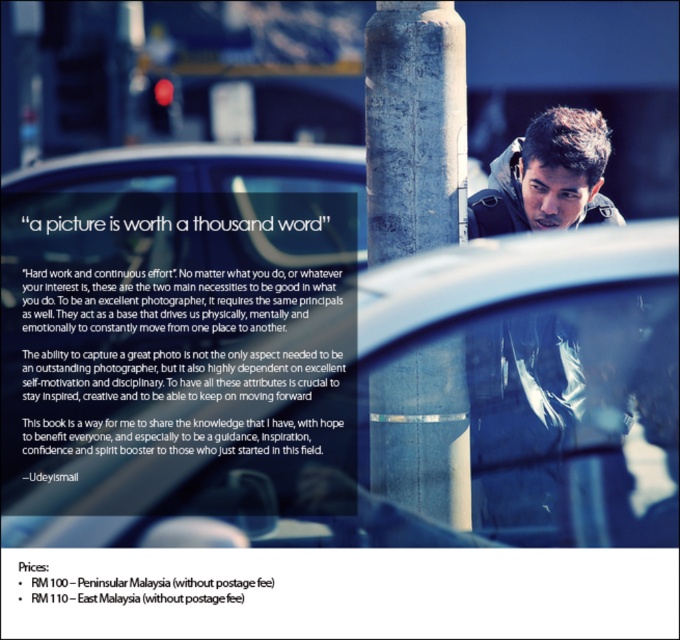
Is point (396, 532) more distant than point (530, 202)?

No, it is in front of (530, 202).

Who is positioned more to the right, clear glass car at center or matte black jacket at upper right?

matte black jacket at upper right

Locate an element on the screen. clear glass car at center is located at coordinates (401, 416).

Does clear glass car at center have a lesser height compared to dark gray jacket at center?

No, clear glass car at center is not shorter than dark gray jacket at center.

Is clear glass car at center in front of dark gray jacket at center?

Yes, clear glass car at center is in front of dark gray jacket at center.

Does point (549, 536) come in front of point (564, 387)?

Yes, it is in front of point (564, 387).

Where is `clear glass car at center`? clear glass car at center is located at coordinates (401, 416).

Does gray concrete pole at center have a greater height compared to dark gray jacket at center?

Indeed, gray concrete pole at center has a greater height compared to dark gray jacket at center.

Measure the distance between gray concrete pole at center and camera.

gray concrete pole at center is 6.06 meters away from camera.

Identify the location of gray concrete pole at center. (413, 129).